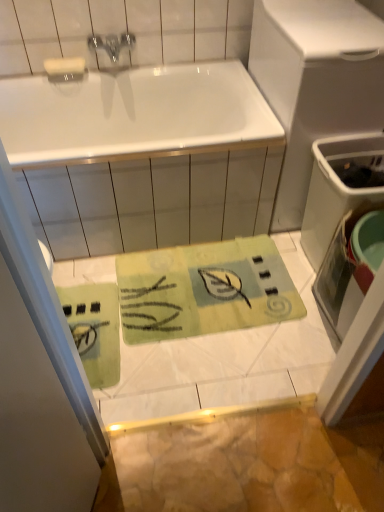
Question: Is green fabric mat at upper center wider than white glossy bathtub at upper center?

Choices:
 (A) no
 (B) yes

Answer: (A)

Question: Is green fabric mat at upper center oriented towards white glossy bathtub at upper center?

Choices:
 (A) yes
 (B) no

Answer: (B)

Question: Considering the relative sizes of green fabric mat at upper center and white glossy bathtub at upper center in the image provided, is green fabric mat at upper center bigger than white glossy bathtub at upper center?

Choices:
 (A) no
 (B) yes

Answer: (A)

Question: From the image's perspective, is green fabric mat at upper center beneath white glossy bathtub at upper center?

Choices:
 (A) yes
 (B) no

Answer: (A)

Question: Is green fabric mat at upper center far away from white glossy bathtub at upper center?

Choices:
 (A) yes
 (B) no

Answer: (A)

Question: From the image's perspective, is white plastic trash can at right above or below white glossy bathtub at upper center?

Choices:
 (A) below
 (B) above

Answer: (B)

Question: From their relative heights in the image, would you say white plastic trash can at right is taller or shorter than white glossy bathtub at upper center?

Choices:
 (A) tall
 (B) short

Answer: (A)

Question: Relative to white glossy bathtub at upper center, is white plastic trash can at right in front or behind?

Choices:
 (A) behind
 (B) front

Answer: (B)

Question: Is white plastic trash can at right bigger or smaller than white glossy bathtub at upper center?

Choices:
 (A) big
 (B) small

Answer: (B)

Question: Is metallic faucet at upper center taller or shorter than green fabric mat at upper center?

Choices:
 (A) tall
 (B) short

Answer: (B)

Question: Would you say metallic faucet at upper center is inside or outside green fabric mat at upper center?

Choices:
 (A) inside
 (B) outside

Answer: (B)

Question: Is point (109, 53) positioned closer to the camera than point (31, 424)?

Choices:
 (A) farther
 (B) closer

Answer: (A)

Question: From the image's perspective, is metallic faucet at upper center located above or below green fabric mat at upper center?

Choices:
 (A) above
 (B) below

Answer: (A)

Question: From a real-world perspective, is white plastic trash can at right positioned above or below green fabric mat at upper center?

Choices:
 (A) above
 (B) below

Answer: (B)

Question: Considering their positions, is white plastic trash can at right located in front of or behind green fabric mat at upper center?

Choices:
 (A) behind
 (B) front

Answer: (A)